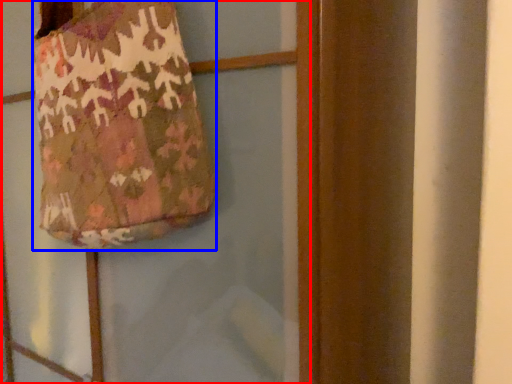
Question: Which object appears closest to the camera in this image, screen door (highlighted by a red box) or handbag (highlighted by a blue box)?

Choices:
 (A) screen door
 (B) handbag

Answer: (A)